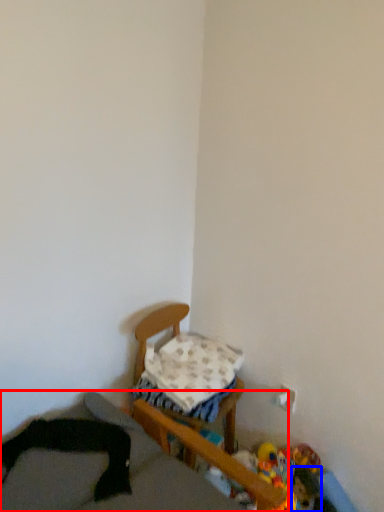
Question: Which object appears closest to the camera in this image, furniture (highlighted by a red box) or toy (highlighted by a blue box)?

Choices:
 (A) furniture
 (B) toy

Answer: (A)